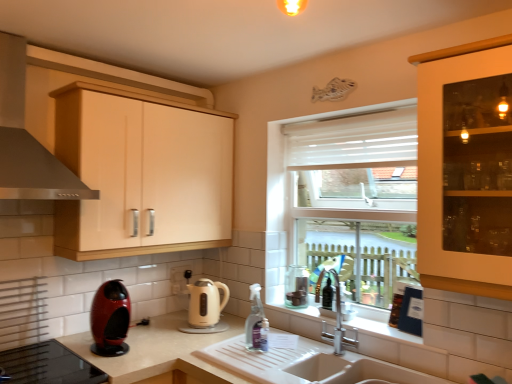
At what (x,y) coordinates should I click in order to perform the action: click on vacant space situated on the left part of beige glossy electric kettle at center. Please return your answer as a coordinate pair (x, y). The image size is (512, 384). Looking at the image, I should click on (162, 331).